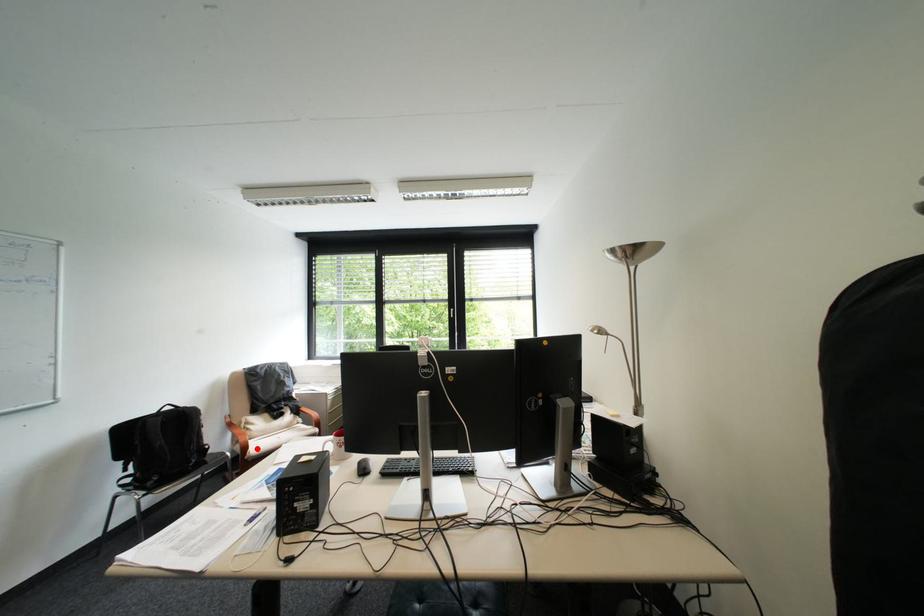
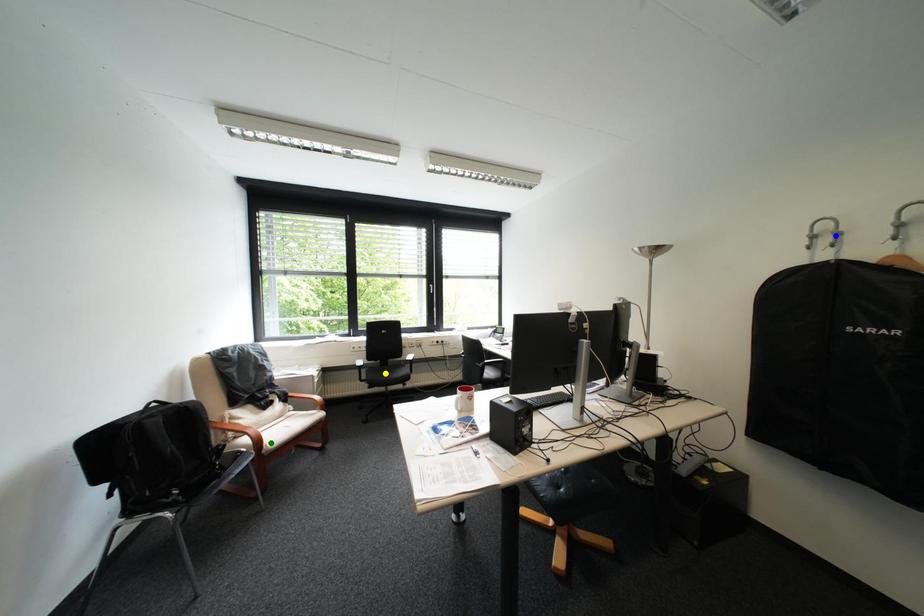
Question: I am providing you with two images of the same scene from different viewpoints. A red point is marked on the first image. You are given multiple points on the second image. Which point in image 2 is actually the same real-world point as the red point in image 1?

Choices:
 (A) yellow point
 (B) blue point
 (C) green point

Answer: (C)